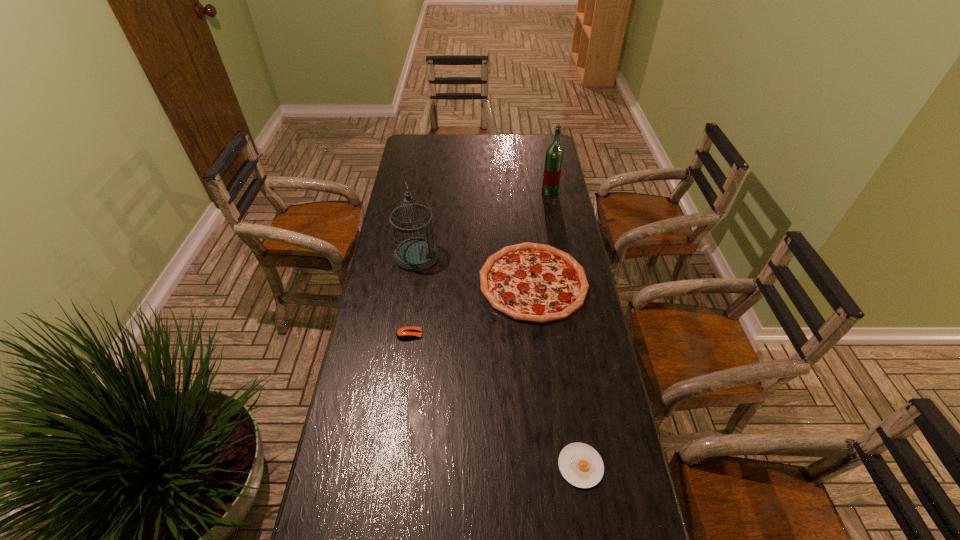
You are a GUI agent. You are given a task and a screenshot of the screen. Output one action in this format:
    pyautogui.click(x=<x>, y=<y>)
    Task: Click on the vacant space situated 0.250m on the back of the second shortest object
    Image resolution: width=960 pixels, height=540 pixels.
    Given the screenshot: What is the action you would take?
    [x=419, y=273]

Locate an element on the screen. The width and height of the screenshot is (960, 540). vacant region located 0.150m on the back of the egg yolk is located at coordinates (569, 392).

I want to click on birdcage present at the left edge, so click(x=415, y=254).

Where is `computer mouse present at the left edge`? The image size is (960, 540). computer mouse present at the left edge is located at coordinates (405, 333).

You are a GUI agent. You are given a task and a screenshot of the screen. Output one action in this format:
    pyautogui.click(x=<x>, y=<y>)
    Task: Click on the liquor located at the right edge
    This screenshot has height=540, width=960.
    Given the screenshot: What is the action you would take?
    pyautogui.click(x=554, y=154)

I want to click on pizza that is positioned at the right edge, so click(x=531, y=282).

Identify the location of egg yolk present at the right edge. The width and height of the screenshot is (960, 540). (581, 465).

Locate an element on the screen. Image resolution: width=960 pixels, height=540 pixels. vacant area at the far edge is located at coordinates (493, 158).

Identify the location of vacant region at the left edge of the desktop. This screenshot has height=540, width=960. (386, 359).

Locate an element on the screen. This screenshot has height=540, width=960. free space at the right edge is located at coordinates (561, 326).